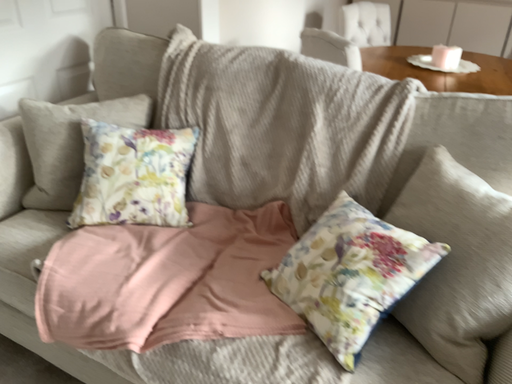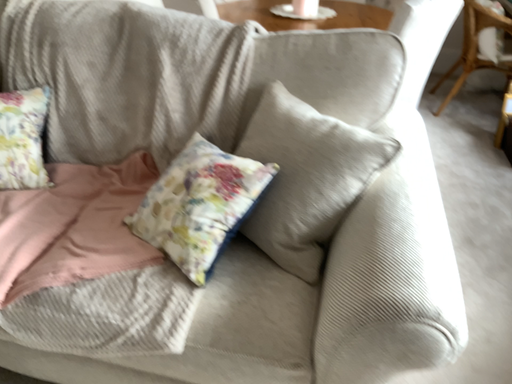
Question: Which way did the camera rotate in the video?

Choices:
 (A) rotated left
 (B) rotated right

Answer: (B)